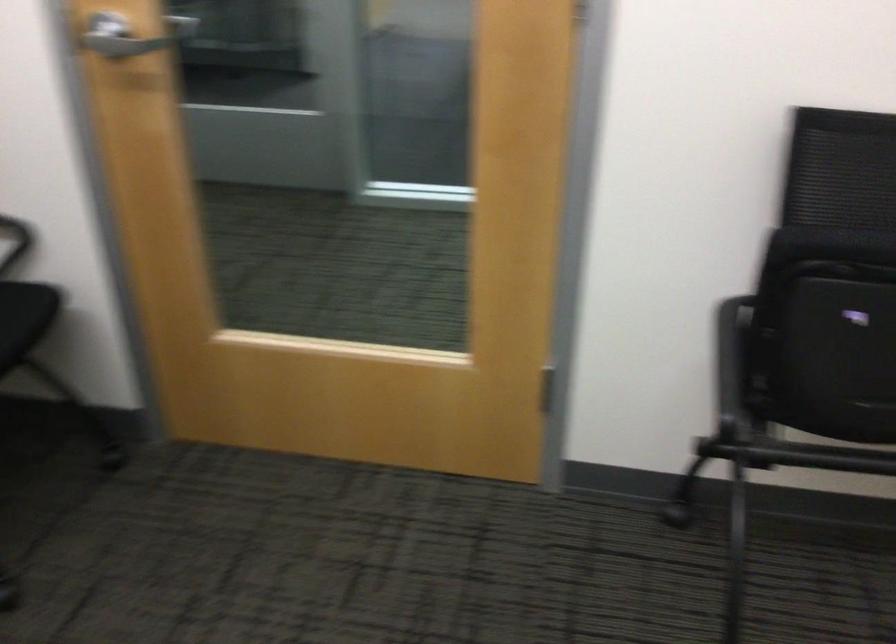
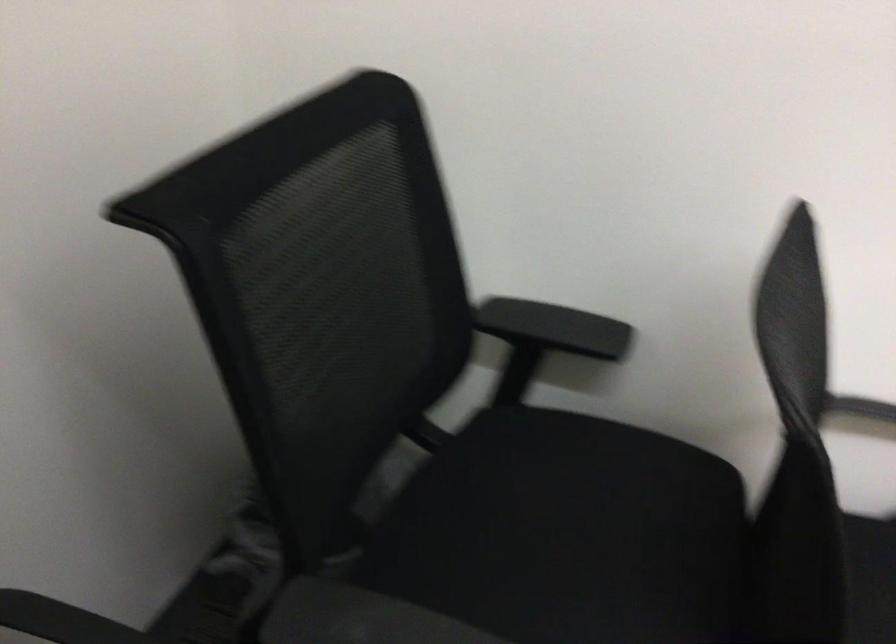
Which direction would the cameraman need to move to produce the second image?

The cameraman walked toward left, forward.